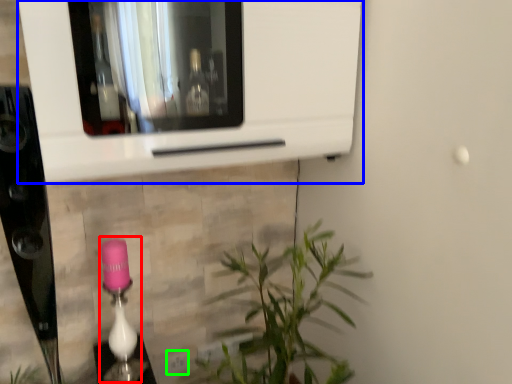
Question: Considering the real-world distances, which object is closest to lamp (highlighted by a red box)? microwave (highlighted by a blue box) or electric outlet (highlighted by a green box).

Choices:
 (A) microwave
 (B) electric outlet

Answer: (B)